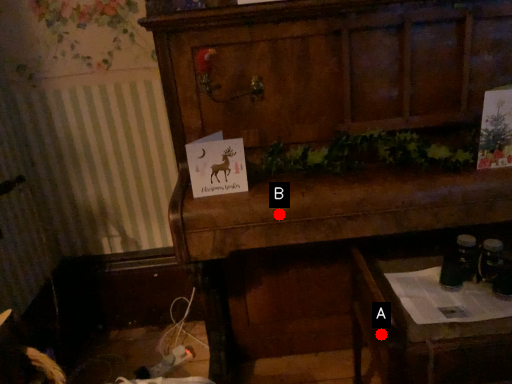
Question: Two points are circled on the image, labeled by A and B beside each circle. Which point appears farthest from the camera in this image?

Choices:
 (A) A is further
 (B) B is further

Answer: (B)